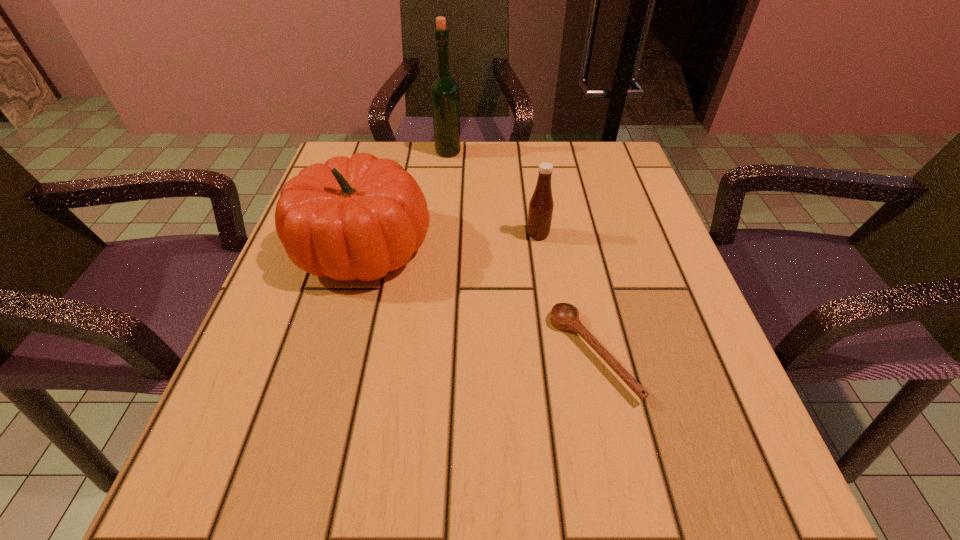
The height and width of the screenshot is (540, 960). Identify the location of the farthest object. (444, 90).

At what (x,y) coordinates should I click in order to perform the action: click on liquor. Please return your answer as a coordinate pair (x, y). The height and width of the screenshot is (540, 960). Looking at the image, I should click on (444, 90).

Where is `pumpkin`? pumpkin is located at coordinates (353, 218).

Image resolution: width=960 pixels, height=540 pixels. In order to click on Tabasco sauce in this screenshot , I will do `click(541, 205)`.

At what (x,y) coordinates should I click in order to perform the action: click on the shortest object. Please return your answer as a coordinate pair (x, y). The width and height of the screenshot is (960, 540). Looking at the image, I should click on (564, 316).

Locate an element on the screen. Image resolution: width=960 pixels, height=540 pixels. wooden spoon is located at coordinates (564, 316).

I want to click on blank space located on the right of the tallest object, so click(x=496, y=152).

Identify the location of vacant region located 0.360m on the right of the pumpkin. (616, 247).

Locate an element on the screen. free location located 0.210m on the left of the Tabasco sauce is located at coordinates (422, 234).

Locate an element on the screen. The height and width of the screenshot is (540, 960). vacant space located on the back of the wooden spoon is located at coordinates (564, 216).